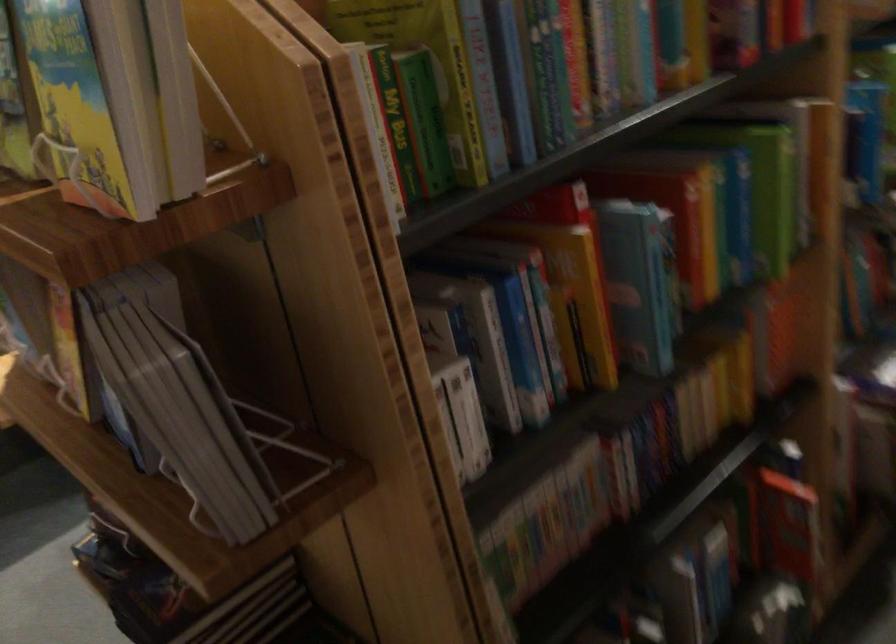
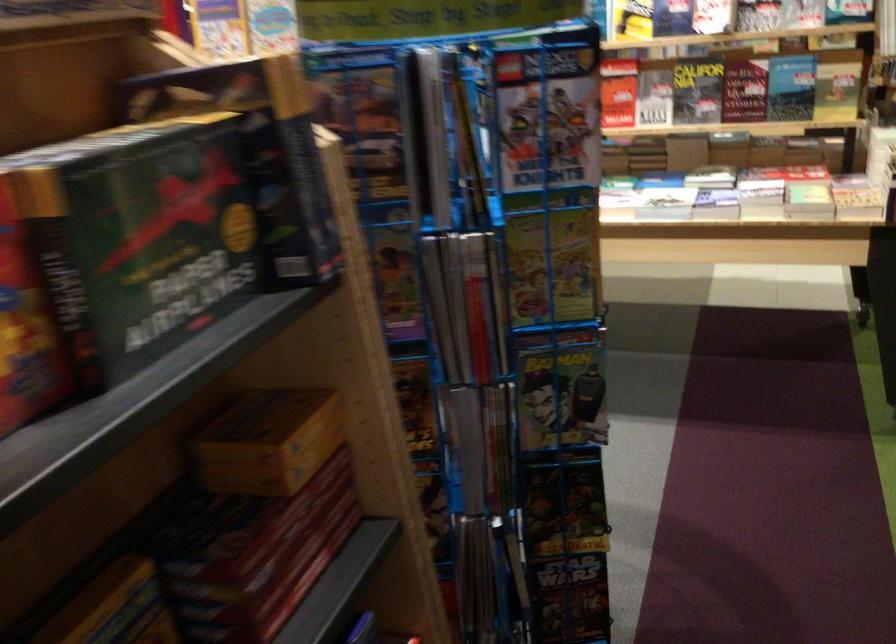
What movement of the cameraman would produce the second image?

The cameraman moved toward right, forward.